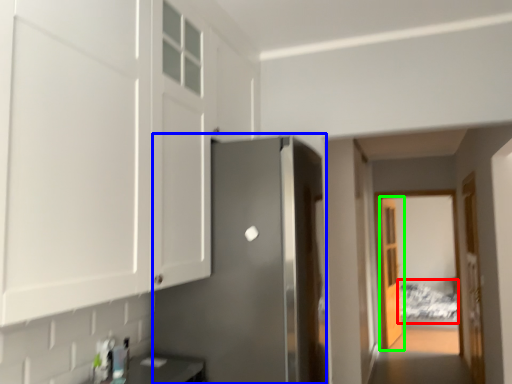
Question: Considering the real-world distances, which object is farthest from bed (highlighted by a red box)? door (highlighted by a blue box) or door (highlighted by a green box)?

Choices:
 (A) door
 (B) door

Answer: (A)